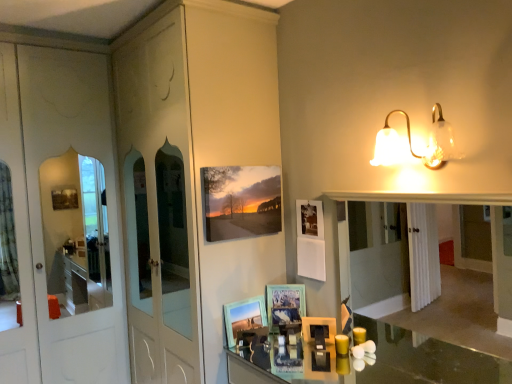
Question: Would you say matte canvas print at upper center, the third picture frame ordered from the bottom, is outside wooden picture frame at center, which appears as the 1th picture frame when ordered from the bottom?

Choices:
 (A) yes
 (B) no

Answer: (A)

Question: Considering the relative positions of matte canvas print at upper center, which is counted as the first picture frame, starting from the top, and wooden picture frame at center, the third picture frame in the top-to-bottom sequence, in the image provided, is matte canvas print at upper center, which is counted as the first picture frame, starting from the top, behind wooden picture frame at center, the third picture frame in the top-to-bottom sequence,?

Choices:
 (A) no
 (B) yes

Answer: (A)

Question: Considering the relative sizes of matte canvas print at upper center, which is counted as the first picture frame, starting from the top, and wooden picture frame at center, the third picture frame in the top-to-bottom sequence, in the image provided, is matte canvas print at upper center, which is counted as the first picture frame, starting from the top, thinner than wooden picture frame at center, the third picture frame in the top-to-bottom sequence,?

Choices:
 (A) no
 (B) yes

Answer: (B)

Question: Is matte canvas print at upper center, which is counted as the first picture frame, starting from the top, to the left of wooden picture frame at center, the third picture frame in the top-to-bottom sequence, from the viewer's perspective?

Choices:
 (A) yes
 (B) no

Answer: (A)

Question: From a real-world perspective, is matte canvas print at upper center, which is counted as the first picture frame, starting from the top, below wooden picture frame at center, the third picture frame in the top-to-bottom sequence?

Choices:
 (A) no
 (B) yes

Answer: (A)

Question: Is yellow wax candle at center to the left or to the right of wooden picture frame at center, the third picture frame in the top-to-bottom sequence, in the image?

Choices:
 (A) right
 (B) left

Answer: (A)

Question: In terms of width, does yellow wax candle at center look wider or thinner when compared to wooden picture frame at center, which appears as the 1th picture frame when ordered from the bottom?

Choices:
 (A) thin
 (B) wide

Answer: (B)

Question: Is yellow wax candle at center bigger or smaller than wooden picture frame at center, which appears as the 1th picture frame when ordered from the bottom?

Choices:
 (A) big
 (B) small

Answer: (B)

Question: From a real-world perspective, is yellow wax candle at center above or below wooden picture frame at center, the third picture frame in the top-to-bottom sequence?

Choices:
 (A) above
 (B) below

Answer: (B)

Question: Would you say wooden picture frame at center, the 2th picture frame from the top, is inside or outside yellow wax candle at center?

Choices:
 (A) outside
 (B) inside

Answer: (A)

Question: Is point (268, 286) positioned closer to the camera than point (334, 339)?

Choices:
 (A) closer
 (B) farther

Answer: (B)

Question: Based on their positions, is wooden picture frame at center, the second picture frame when ordered from bottom to top, located to the left or right of yellow wax candle at center?

Choices:
 (A) left
 (B) right

Answer: (A)

Question: In terms of height, does wooden picture frame at center, the 2th picture frame from the top, look taller or shorter compared to yellow wax candle at center?

Choices:
 (A) tall
 (B) short

Answer: (A)

Question: Does point (268, 223) appear closer or farther from the camera than point (280, 314)?

Choices:
 (A) closer
 (B) farther

Answer: (B)

Question: Is matte canvas print at upper center, which is counted as the first picture frame, starting from the top, inside the boundaries of wooden picture frame at center, the 2th picture frame from the top, or outside?

Choices:
 (A) inside
 (B) outside

Answer: (B)